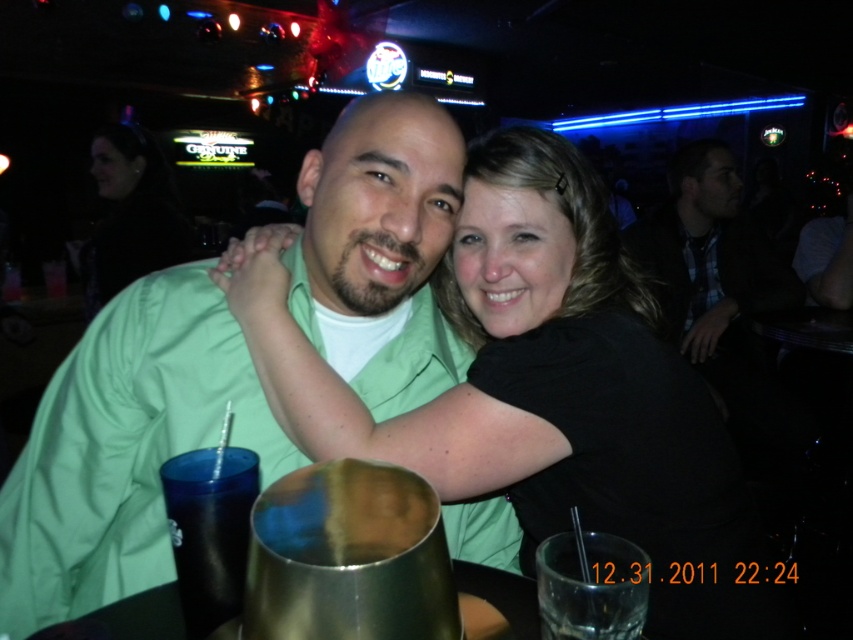
Can you confirm if black matte shirt at center is shorter than black fabric at upper left?

Yes.

Who is more forward, [492,276] or [114,164]?

Point [492,276] is more forward.

This screenshot has height=640, width=853. Identify the location of black matte shirt at center. (538, 385).

Who is lower down, black matte shirt at center or green matte shirt at center?

black matte shirt at center

Describe the element at coordinates (538, 385) in the screenshot. I see `black matte shirt at center` at that location.

This screenshot has height=640, width=853. What do you see at coordinates (538, 385) in the screenshot? I see `black matte shirt at center` at bounding box center [538, 385].

In order to click on black matte shirt at center in this screenshot , I will do `click(538, 385)`.

Between green matte shirt at center and black fabric at upper left, which one is positioned lower?

Positioned lower is green matte shirt at center.

Describe the element at coordinates (125, 448) in the screenshot. I see `green matte shirt at center` at that location.

You are a GUI agent. You are given a task and a screenshot of the screen. Output one action in this format:
    pyautogui.click(x=<x>, y=<y>)
    Task: Click on the green matte shirt at center
    The image size is (853, 640).
    Given the screenshot: What is the action you would take?
    pyautogui.click(x=125, y=448)